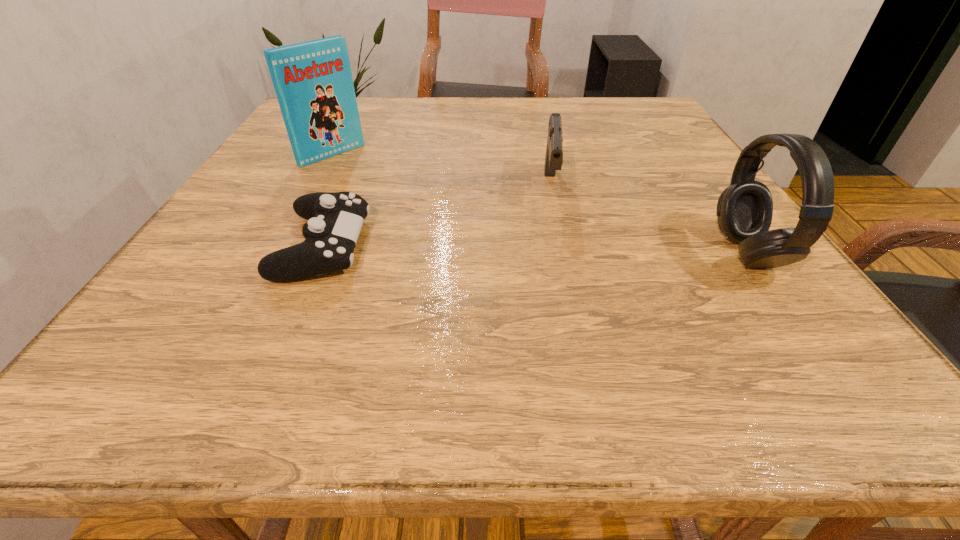
Where is `object that is at the right edge`? object that is at the right edge is located at coordinates (744, 212).

What are the coordinates of `object present at the near left corner` in the screenshot? It's located at (335, 219).

This screenshot has width=960, height=540. I want to click on object present at the near right corner, so [x=744, y=212].

Where is `vacant space at the far edge of the desktop`? The width and height of the screenshot is (960, 540). vacant space at the far edge of the desktop is located at coordinates (416, 113).

Find the location of a particular element. blank area at the near edge is located at coordinates (348, 305).

Locate an element on the screen. This screenshot has height=540, width=960. vacant space at the left edge of the desktop is located at coordinates (242, 219).

Identify the location of free region at the right edge of the desktop. (657, 158).

Where is `free space at the far right corner`? The image size is (960, 540). free space at the far right corner is located at coordinates (612, 113).

Where is `blank region between the third tallest object and the book`? The image size is (960, 540). blank region between the third tallest object and the book is located at coordinates (441, 171).

Locate an element on the screen. This screenshot has height=540, width=960. vacant space that's between the book and the third shortest object is located at coordinates (539, 204).